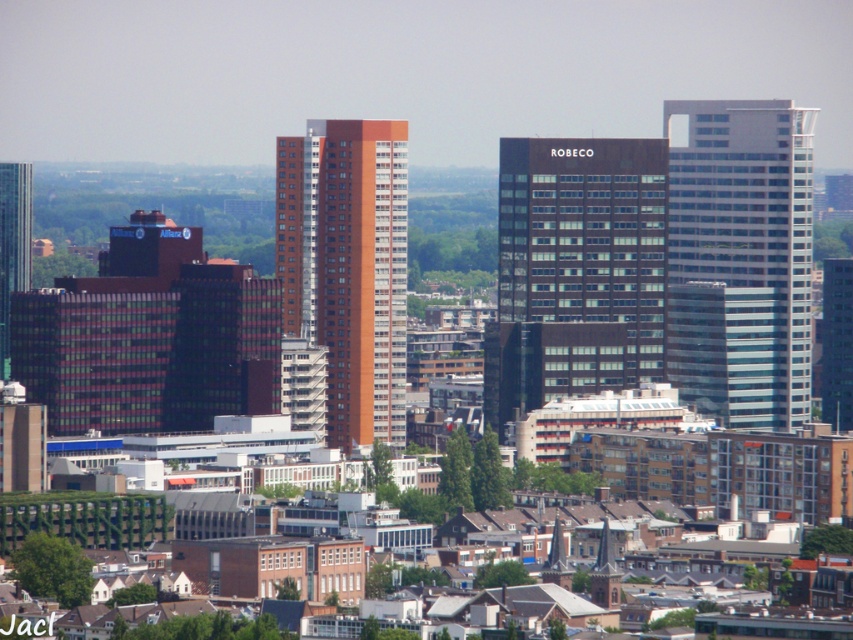
I want to click on dark glass building at center, so click(575, 269).

Which of these two, dark glass building at center or green glass skyscraper at left, stands taller?

With more height is dark glass building at center.

Who is more distant from viewer, (514, 241) or (3, 307)?

Point (3, 307)

Identify the location of dark glass building at center. Image resolution: width=853 pixels, height=640 pixels. 575,269.

Is dark glass building at center above glassy blue skyscraper at right?

No, dark glass building at center is not above glassy blue skyscraper at right.

Who is positioned more to the left, dark glass building at center or glassy blue skyscraper at right?

Positioned to the left is dark glass building at center.

Is point (618, 308) farther from viewer compared to point (688, 124)?

No, it is in front of (688, 124).

This screenshot has width=853, height=640. I want to click on dark glass building at center, so click(x=575, y=269).

Who is positioned more to the left, dark glass building at center or brown matte building at center?

brown matte building at center is more to the left.

Which is below, dark glass building at center or brown matte building at center?

dark glass building at center

Is point (572, 160) farther from camera compared to point (374, 369)?

Yes, it is.

At what (x,y) coordinates should I click in order to perform the action: click on dark glass building at center. Please return your answer as a coordinate pair (x, y). This screenshot has height=640, width=853. Looking at the image, I should click on (575, 269).